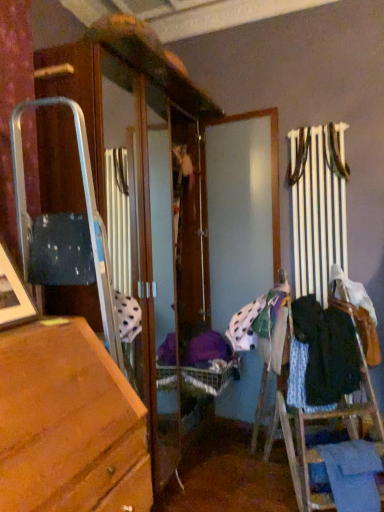
The image size is (384, 512). In order to click on blue fabric at lower right, positioned as the first clothing in bottom-to-top order in this screenshot , I will do `click(352, 475)`.

What do you see at coordinates (352, 475) in the screenshot?
I see `blue fabric at lower right, positioned as the first clothing in bottom-to-top order` at bounding box center [352, 475].

What do you see at coordinates (322, 355) in the screenshot? I see `dark blue fabric at right, which is counted as the 1th clothing, starting from the top` at bounding box center [322, 355].

Locate an element on the screen. dark blue fabric at right, the second clothing when ordered from bottom to top is located at coordinates (x=322, y=355).

At what (x,y) coordinates should I click in order to perform the action: click on blue fabric at lower right, which is the second clothing from top to bottom. Please return your answer as a coordinate pair (x, y). Looking at the image, I should click on (352, 475).

In the image, is dark blue fabric at right, the second clothing when ordered from bottom to top, on the left side or the right side of blue fabric at lower right, positioned as the first clothing in bottom-to-top order?

Based on their positions, dark blue fabric at right, the second clothing when ordered from bottom to top, is located to the left of blue fabric at lower right, positioned as the first clothing in bottom-to-top order.

From the picture: Which object is further away from the camera taking this photo, dark blue fabric at right, which is counted as the 1th clothing, starting from the top, or blue fabric at lower right, which is the second clothing from top to bottom?

dark blue fabric at right, which is counted as the 1th clothing, starting from the top, is more distant.

Which is in front, point (304, 334) or point (340, 498)?

The point (340, 498) is closer to the camera.

From the image's perspective, is dark blue fabric at right, the second clothing when ordered from bottom to top, positioned above or below blue fabric at lower right, which is the second clothing from top to bottom?

From the image's perspective, dark blue fabric at right, the second clothing when ordered from bottom to top, appears above blue fabric at lower right, which is the second clothing from top to bottom.

From a real-world perspective, is dark blue fabric at right, the second clothing when ordered from bottom to top, positioned over blue fabric at lower right, positioned as the first clothing in bottom-to-top order, based on gravity?

Yes, from a real-world perspective, dark blue fabric at right, the second clothing when ordered from bottom to top, is over blue fabric at lower right, positioned as the first clothing in bottom-to-top order

From the picture: Can you confirm if dark blue fabric at right, the second clothing when ordered from bottom to top, is wider than blue fabric at lower right, which is the second clothing from top to bottom?

Yes, dark blue fabric at right, the second clothing when ordered from bottom to top, is wider than blue fabric at lower right, which is the second clothing from top to bottom.

Does dark blue fabric at right, the second clothing when ordered from bottom to top, have a greater height compared to blue fabric at lower right, positioned as the first clothing in bottom-to-top order?

Indeed, dark blue fabric at right, the second clothing when ordered from bottom to top, has a greater height compared to blue fabric at lower right, positioned as the first clothing in bottom-to-top order.

Which of these two, dark blue fabric at right, which is counted as the 1th clothing, starting from the top, or blue fabric at lower right, positioned as the first clothing in bottom-to-top order, is smaller?

blue fabric at lower right, positioned as the first clothing in bottom-to-top order.

Would you say dark blue fabric at right, which is counted as the 1th clothing, starting from the top, contains blue fabric at lower right, positioned as the first clothing in bottom-to-top order?

No.

Are dark blue fabric at right, which is counted as the 1th clothing, starting from the top, and blue fabric at lower right, which is the second clothing from top to bottom, located far from each other?

dark blue fabric at right, which is counted as the 1th clothing, starting from the top, is near blue fabric at lower right, which is the second clothing from top to bottom, not far away.

Is dark blue fabric at right, which is counted as the 1th clothing, starting from the top, aimed at blue fabric at lower right, positioned as the first clothing in bottom-to-top order?

No, dark blue fabric at right, which is counted as the 1th clothing, starting from the top, is not facing towards blue fabric at lower right, positioned as the first clothing in bottom-to-top order.

The width and height of the screenshot is (384, 512). What are the coordinates of `clothing that is above the blue fabric at lower right, which is the second clothing from top to bottom (from the image's perspective)` in the screenshot? It's located at (322, 355).

Based on the photo, considering the relative positions of blue fabric at lower right, positioned as the first clothing in bottom-to-top order, and dark blue fabric at right, which is counted as the 1th clothing, starting from the top, in the image provided, is blue fabric at lower right, positioned as the first clothing in bottom-to-top order, to the right of dark blue fabric at right, which is counted as the 1th clothing, starting from the top, from the viewer's perspective?

Indeed, blue fabric at lower right, positioned as the first clothing in bottom-to-top order, is positioned on the right side of dark blue fabric at right, which is counted as the 1th clothing, starting from the top.

Considering their positions, is blue fabric at lower right, which is the second clothing from top to bottom, located in front of or behind dark blue fabric at right, which is counted as the 1th clothing, starting from the top?

blue fabric at lower right, which is the second clothing from top to bottom, is in front of dark blue fabric at right, which is counted as the 1th clothing, starting from the top.

Does point (324, 460) come in front of point (351, 362)?

Yes, point (324, 460) is closer to viewer.

From the image's perspective, which is above, blue fabric at lower right, which is the second clothing from top to bottom, or dark blue fabric at right, which is counted as the 1th clothing, starting from the top?

dark blue fabric at right, which is counted as the 1th clothing, starting from the top.

From a real-world perspective, which object rests below the other?

From a 3D spatial view, blue fabric at lower right, positioned as the first clothing in bottom-to-top order, is below.

Which of these two, blue fabric at lower right, which is the second clothing from top to bottom, or dark blue fabric at right, the second clothing when ordered from bottom to top, is thinner?

Thinner between the two is blue fabric at lower right, which is the second clothing from top to bottom.

Considering the sizes of blue fabric at lower right, positioned as the first clothing in bottom-to-top order, and dark blue fabric at right, the second clothing when ordered from bottom to top, in the image, is blue fabric at lower right, positioned as the first clothing in bottom-to-top order, taller or shorter than dark blue fabric at right, the second clothing when ordered from bottom to top,?

blue fabric at lower right, positioned as the first clothing in bottom-to-top order, is shorter than dark blue fabric at right, the second clothing when ordered from bottom to top.

Based on their sizes in the image, would you say blue fabric at lower right, which is the second clothing from top to bottom, is bigger or smaller than dark blue fabric at right, which is counted as the 1th clothing, starting from the top?

blue fabric at lower right, which is the second clothing from top to bottom, is smaller than dark blue fabric at right, which is counted as the 1th clothing, starting from the top.

Is blue fabric at lower right, which is the second clothing from top to bottom, located outside dark blue fabric at right, which is counted as the 1th clothing, starting from the top?

That's correct, blue fabric at lower right, which is the second clothing from top to bottom, is outside of dark blue fabric at right, which is counted as the 1th clothing, starting from the top.

Can you see blue fabric at lower right, positioned as the first clothing in bottom-to-top order, touching dark blue fabric at right, which is counted as the 1th clothing, starting from the top?

No.

Is blue fabric at lower right, which is the second clothing from top to bottom, oriented towards dark blue fabric at right, the second clothing when ordered from bottom to top?

No, blue fabric at lower right, which is the second clothing from top to bottom, does not turn towards dark blue fabric at right, the second clothing when ordered from bottom to top.

In the scene shown: Can you tell me how much blue fabric at lower right, which is the second clothing from top to bottom, and dark blue fabric at right, which is counted as the 1th clothing, starting from the top, differ in facing direction?

blue fabric at lower right, which is the second clothing from top to bottom, and dark blue fabric at right, which is counted as the 1th clothing, starting from the top, are facing 0.000324 degrees away from each other.

How much distance is there between blue fabric at lower right, which is the second clothing from top to bottom, and dark blue fabric at right, the second clothing when ordered from bottom to top?

They are 15.92 inches apart.

The height and width of the screenshot is (512, 384). In order to click on clothing in front of the dark blue fabric at right, which is counted as the 1th clothing, starting from the top in this screenshot , I will do `click(352, 475)`.

What are the coordinates of `clothing to the left of blue fabric at lower right, positioned as the first clothing in bottom-to-top order` in the screenshot? It's located at (322, 355).

Where is `clothing lying on the right of dark blue fabric at right, the second clothing when ordered from bottom to top`? Image resolution: width=384 pixels, height=512 pixels. clothing lying on the right of dark blue fabric at right, the second clothing when ordered from bottom to top is located at coordinates (352, 475).